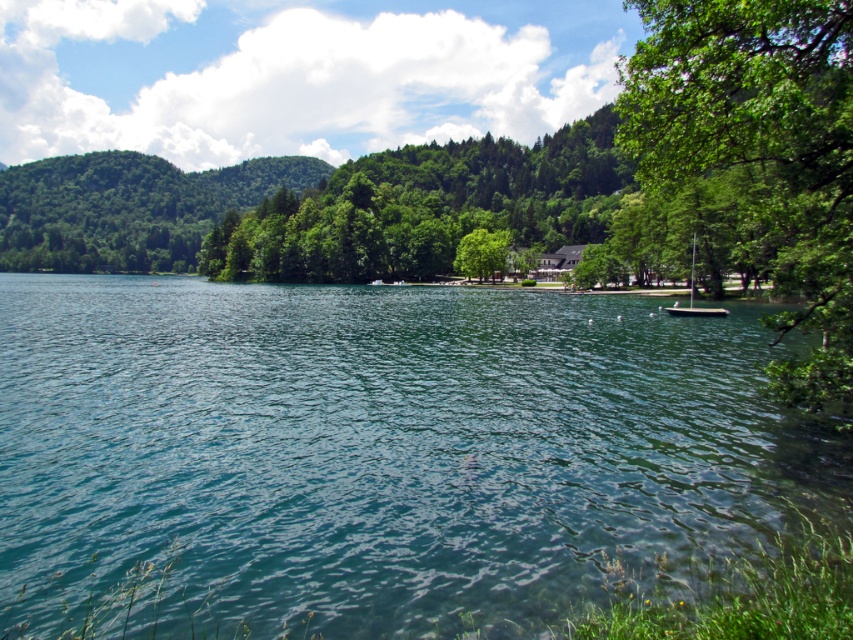
Question: Can you confirm if clear blue water at center is positioned to the left of green leafy tree at right?

Choices:
 (A) yes
 (B) no

Answer: (A)

Question: Which point appears farthest from the camera in this image?

Choices:
 (A) (630, 552)
 (B) (685, 308)
 (C) (463, 266)
 (D) (645, 3)

Answer: (C)

Question: Does green leafy tree at right have a smaller size compared to white plastic boat at right?

Choices:
 (A) yes
 (B) no

Answer: (B)

Question: Among these objects, which one is farthest from the camera?

Choices:
 (A) green leafy tree at center
 (B) white plastic boat at right
 (C) green leafy tree at right

Answer: (A)

Question: From the image, what is the correct spatial relationship of green leafy tree at right in relation to white plastic boat at right?

Choices:
 (A) above
 (B) below

Answer: (A)

Question: Estimate the real-world distances between objects in this image. Which object is closer to the green leafy tree at right?

Choices:
 (A) clear blue water at center
 (B) green leafy tree at center

Answer: (A)